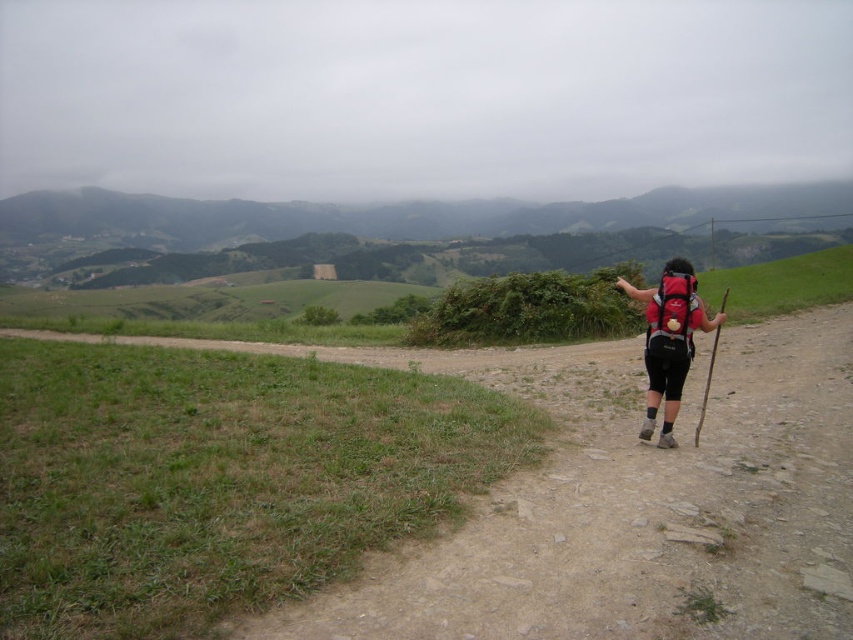
You are a hiker carrying a matte red backpack at right and want to walk along the dirt path at right. How much space is there between your backpack and the path?

The dirt path at right and matte red backpack at right are 1.91 meters apart.

You are a hiker trying to find the dirt path at right. Based on the scene description, where would you look to locate it?

The dirt path at right is located at point (634, 504).

From the picture: You are the hiker in the image. You notice two points marked on your map corresponding to coordinates point (566, 604) and point (679, 284). Which point is closer to your current position?

Point (566, 604) is in front of point (679, 284), so the point closer to your current position is point (566, 604).